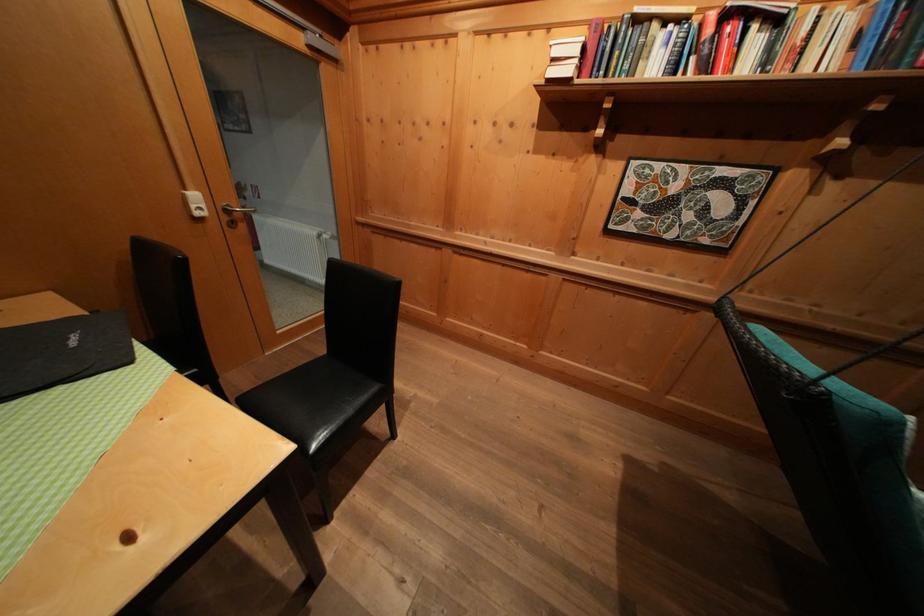
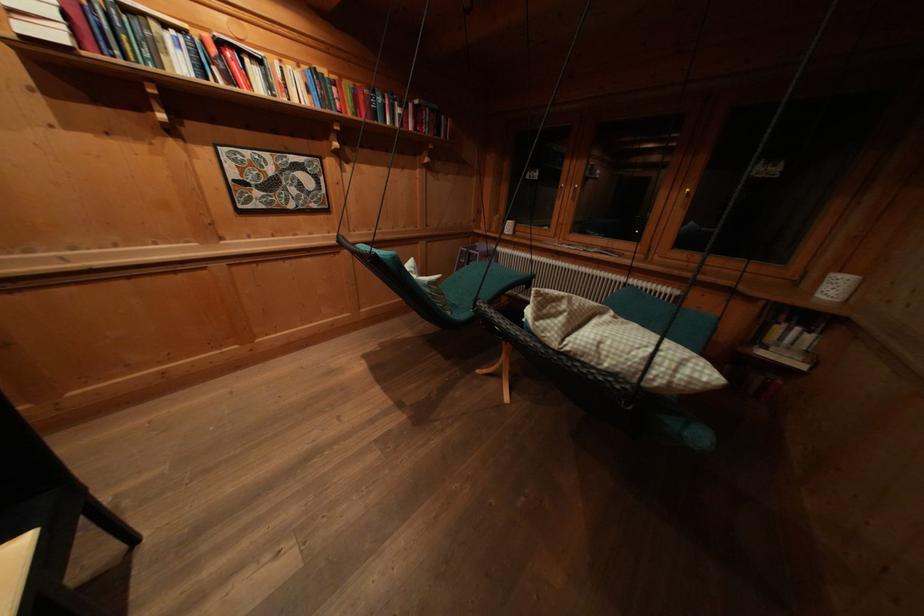
The images are taken continuously from a first-person perspective. In which direction is your viewpoint rotating?

The camera's rotation is toward right-down.